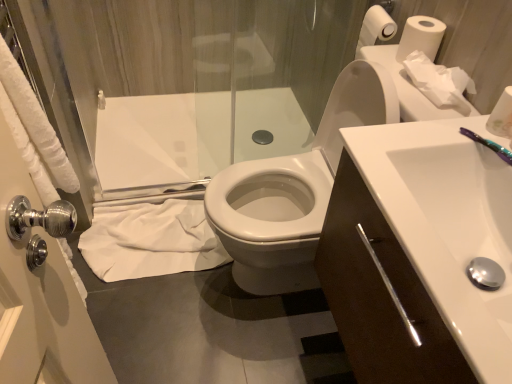
Question: Would you say purple plastic toothbrush at upper right is to the left or to the right of white matte toilet paper at upper right, the 4th toilet paper positioned from the back, in the picture?

Choices:
 (A) left
 (B) right

Answer: (A)

Question: Is purple plastic toothbrush at upper right in front of or behind white matte toilet paper at upper right, positioned as the 4th toilet paper in top-to-bottom order, in the image?

Choices:
 (A) front
 (B) behind

Answer: (A)

Question: Estimate the real-world distances between objects in this image. Which object is closer to the transparent glass shower door at upper left?

Choices:
 (A) white matte toilet paper at upper right, positioned as the 4th toilet paper in top-to-bottom order
 (B) purple plastic toothbrush at upper right
 (C) white glossy sink at center right
 (D) white glossy toilet at center
 (E) white paper roll at upper right, which is counted as the 4th toilet paper, starting from the front

Answer: (D)

Question: Which object is the closest to the white paper roll at upper right, which ranks as the 4th toilet paper in bottom-to-top order?

Choices:
 (A) white paper tissue at upper right, marked as the third toilet paper in a top-to-bottom arrangement
 (B) transparent glass shower door at upper left
 (C) white glossy sink at center right
 (D) white cloth at lower left
 (E) white matte toilet paper at upper right, positioned as the 4th toilet paper in top-to-bottom order

Answer: (A)